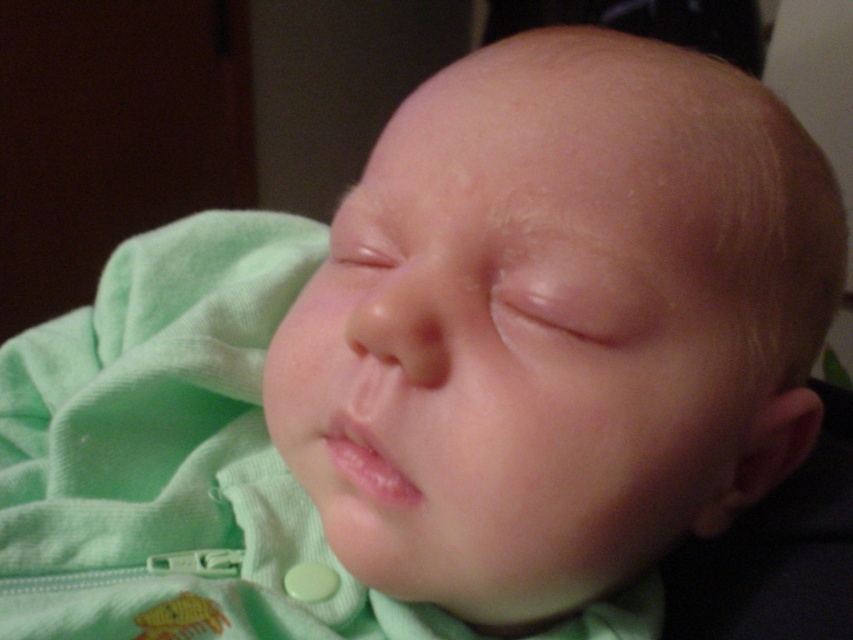
Question: Based on their relative distances, which object is nearer to the green soft fabric at center?

Choices:
 (A) smooth green baby at center
 (B) clear plastic teething ring at lower center

Answer: (A)

Question: Does smooth green baby at center have a smaller size compared to green soft fabric at center?

Choices:
 (A) no
 (B) yes

Answer: (B)

Question: Is smooth green baby at center further to camera compared to clear plastic teething ring at lower center?

Choices:
 (A) no
 (B) yes

Answer: (A)

Question: Which point appears closest to the camera in this image?

Choices:
 (A) (367, 497)
 (B) (62, 374)

Answer: (A)

Question: Among these objects, which one is farthest from the camera?

Choices:
 (A) clear plastic teething ring at lower center
 (B) green soft fabric at center
 (C) smooth green baby at center

Answer: (B)

Question: Does smooth green baby at center have a lesser width compared to clear plastic teething ring at lower center?

Choices:
 (A) no
 (B) yes

Answer: (A)